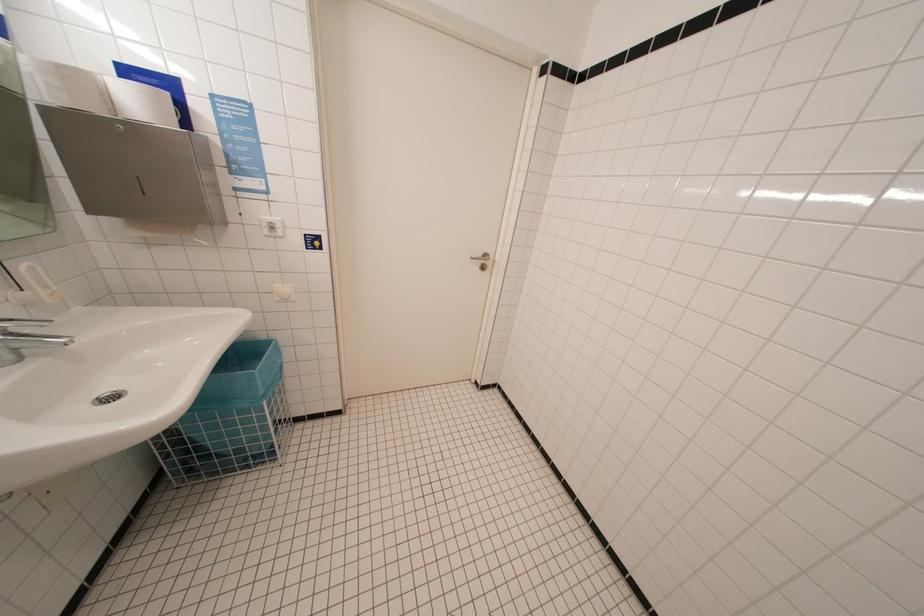
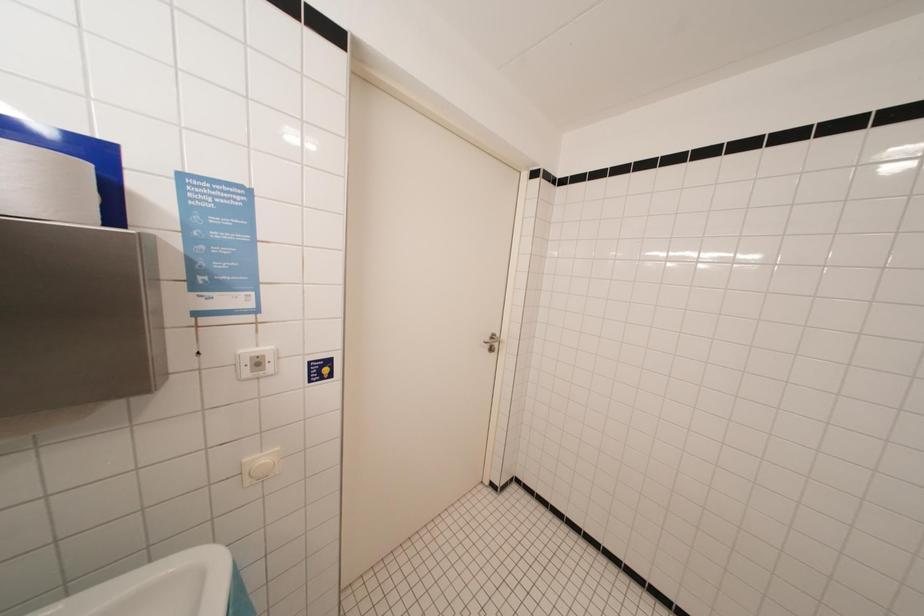
Which direction would the cameraman need to move to produce the second image?

The cameraman moved toward left, forward.